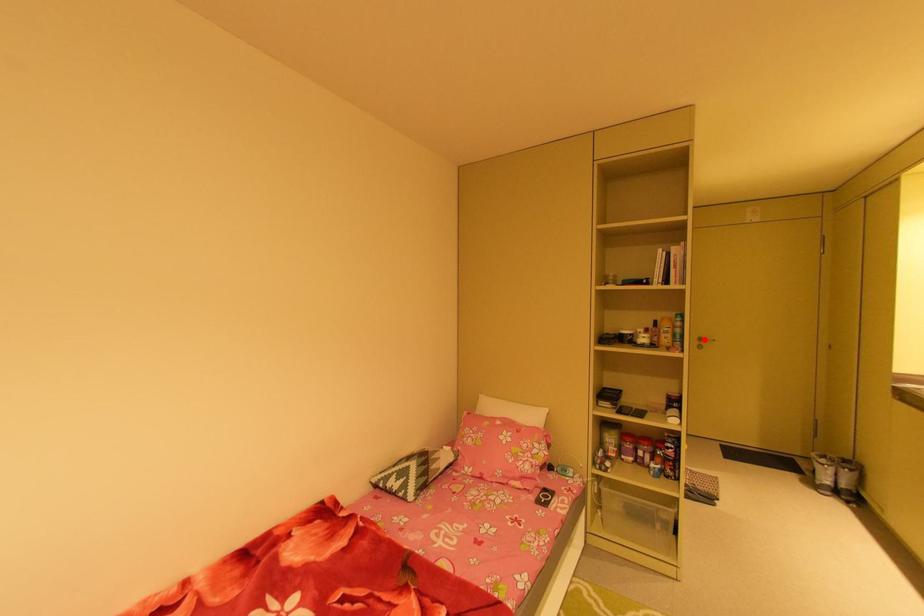
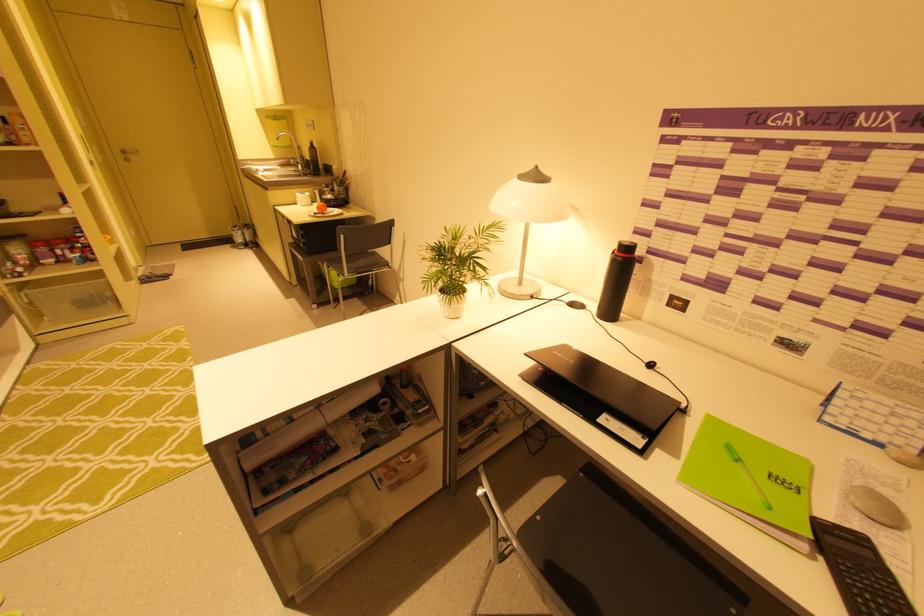
Question: A red point is marked in image1. In image2, is the corresponding 3D point closer to the camera or farther? Reply with the corresponding letter.

Choices:
 (A) The corresponding 3D point is closer.
 (B) The corresponding 3D point is farther.

Answer: (A)